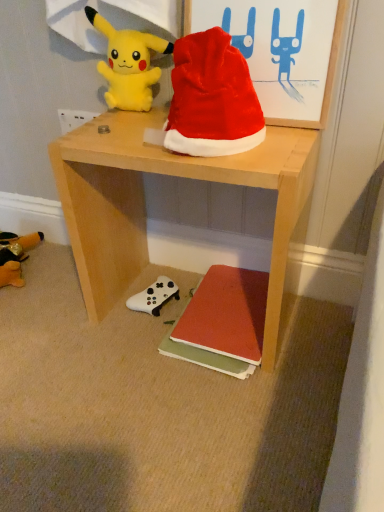
Question: From the image's perspective, is yellow plush at upper left over white plastic power outlet at upper left?

Choices:
 (A) no
 (B) yes

Answer: (B)

Question: Is yellow plush at upper left further to the viewer compared to white plastic power outlet at upper left?

Choices:
 (A) no
 (B) yes

Answer: (A)

Question: Can you confirm if yellow plush at upper left is positioned to the left of white plastic power outlet at upper left?

Choices:
 (A) yes
 (B) no

Answer: (B)

Question: Can you confirm if yellow plush at upper left is shorter than white plastic power outlet at upper left?

Choices:
 (A) no
 (B) yes

Answer: (A)

Question: Are yellow plush at upper left and white plastic power outlet at upper left located far from each other?

Choices:
 (A) no
 (B) yes

Answer: (A)

Question: Does yellow plush at upper left appear on the right side of white plastic power outlet at upper left?

Choices:
 (A) no
 (B) yes

Answer: (B)

Question: Considering the relative sizes of white plastic power outlet at upper left and red velvet santa hat at upper center in the image provided, is white plastic power outlet at upper left bigger than red velvet santa hat at upper center?

Choices:
 (A) no
 (B) yes

Answer: (A)

Question: Is white plastic power outlet at upper left at the left side of red velvet santa hat at upper center?

Choices:
 (A) yes
 (B) no

Answer: (A)

Question: Can you confirm if white plastic power outlet at upper left is smaller than red velvet santa hat at upper center?

Choices:
 (A) no
 (B) yes

Answer: (B)

Question: Is white plastic power outlet at upper left surrounding red velvet santa hat at upper center?

Choices:
 (A) yes
 (B) no

Answer: (B)

Question: Is white plastic power outlet at upper left not inside red velvet santa hat at upper center?

Choices:
 (A) no
 (B) yes

Answer: (B)

Question: Is the surface of white plastic power outlet at upper left in direct contact with red velvet santa hat at upper center?

Choices:
 (A) no
 (B) yes

Answer: (A)

Question: Is white plastic power outlet at upper left thinner than red matte book at lower center?

Choices:
 (A) no
 (B) yes

Answer: (B)